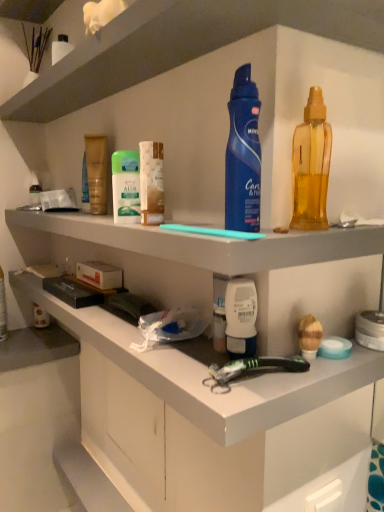
Where is `free spot to the left of translucent yellow liquid at right, which is the first cleaning product in right-to-left order`? free spot to the left of translucent yellow liquid at right, which is the first cleaning product in right-to-left order is located at coordinates (220, 228).